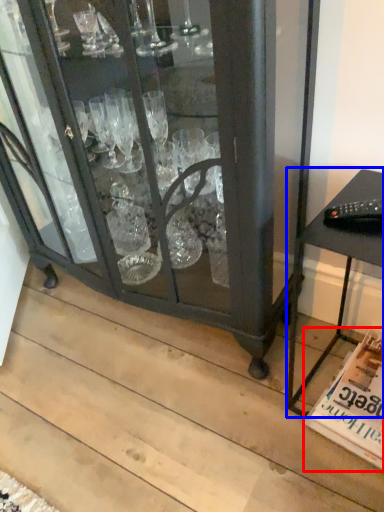
Question: Which point is further to the camera, magazine (highlighted by a red box) or table (highlighted by a blue box)?

Choices:
 (A) magazine
 (B) table

Answer: (A)